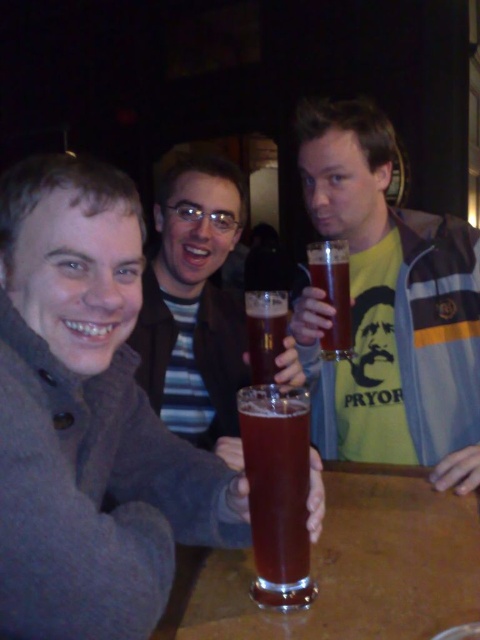
You are standing at the origin point in the image. Where is the matte brown jacket at left located in terms of coordinates?

The matte brown jacket at left is located at coordinates point (87, 419).